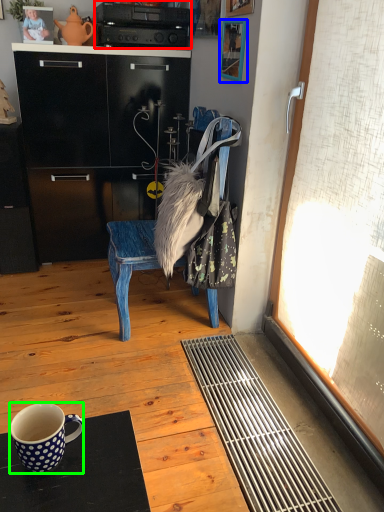
Question: Which object is positioned farthest from appliance (highlighted by a red box)? Select from picture frame (highlighted by a blue box) and coffee cup (highlighted by a green box).

Choices:
 (A) picture frame
 (B) coffee cup

Answer: (B)